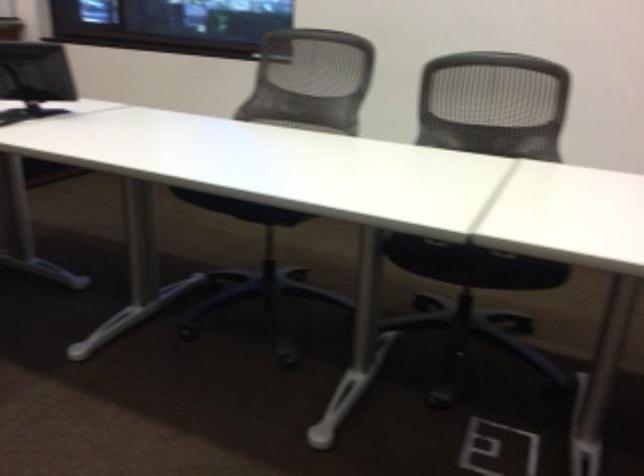
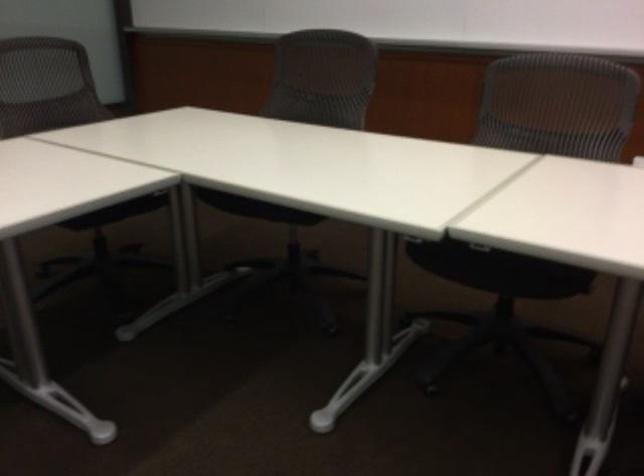
The first image is from the beginning of the video and the second image is from the end. How did the camera likely rotate when shooting the video?

The camera rotated toward left-down.